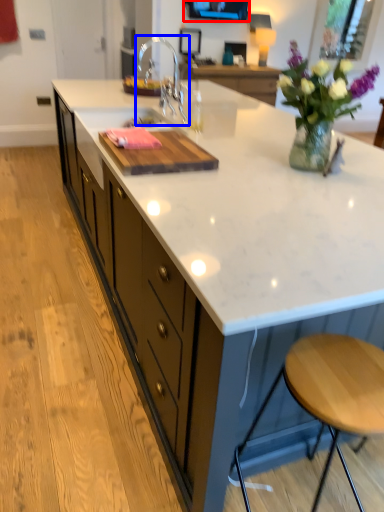
Question: Which of the following is the closest to the observer, window screen (highlighted by a red box) or tap (highlighted by a blue box)?

Choices:
 (A) window screen
 (B) tap

Answer: (B)